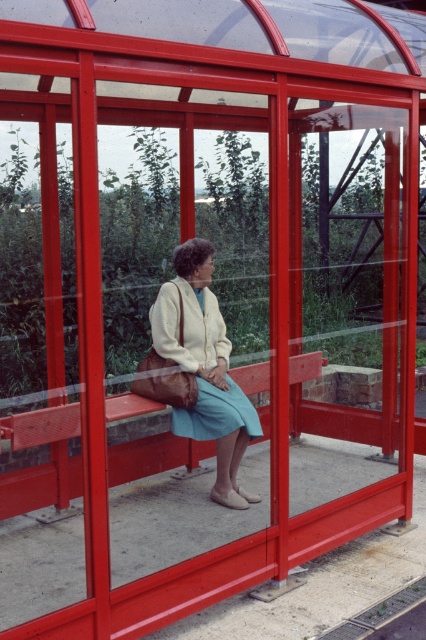
Question: Can you confirm if matte cream sweater at center is positioned to the right of wooden bench at center?

Choices:
 (A) no
 (B) yes

Answer: (B)

Question: In this image, where is matte cream sweater at center located relative to wooden bench at center?

Choices:
 (A) below
 (B) above

Answer: (B)

Question: Which point appears farthest from the camera in this image?

Choices:
 (A) (74, 474)
 (B) (210, 422)

Answer: (A)

Question: Which of the following is the closest to the observer?

Choices:
 (A) (80, 493)
 (B) (229, 460)

Answer: (B)

Question: Which point is farther to the camera?

Choices:
 (A) (195, 280)
 (B) (250, 385)

Answer: (B)

Question: Is matte cream sweater at center below wooden bench at center?

Choices:
 (A) yes
 (B) no

Answer: (B)